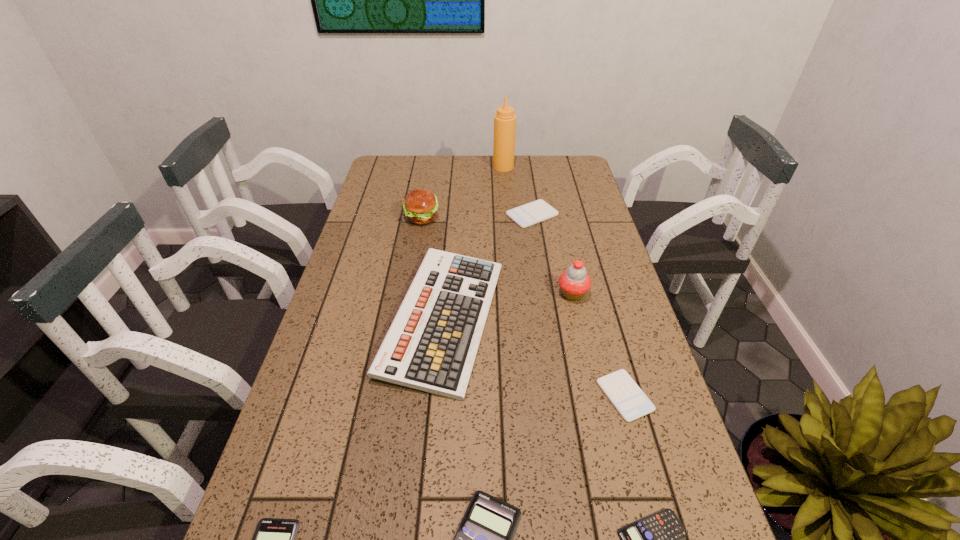
Find the location of a particular element. the farthest object is located at coordinates pyautogui.click(x=504, y=120).

Locate an element on the screen. the tallest object is located at coordinates click(x=504, y=120).

This screenshot has height=540, width=960. What are the coordinates of `cupcake` in the screenshot? It's located at (574, 283).

I want to click on the seventh shortest object, so click(x=420, y=205).

Find the location of a particular element. white computer keyboard is located at coordinates (431, 345).

Where is `the sixth shortest object`? Image resolution: width=960 pixels, height=540 pixels. the sixth shortest object is located at coordinates (431, 345).

Image resolution: width=960 pixels, height=540 pixels. In order to click on the farther white calculator in this screenshot , I will do `click(537, 211)`.

Identify the location of the fifth tallest object. [537, 211].

Where is `the nearer white calculator`? the nearer white calculator is located at coordinates (627, 397).

The width and height of the screenshot is (960, 540). What are the coordinates of `the fourth nearest calculator` in the screenshot? It's located at (627, 397).